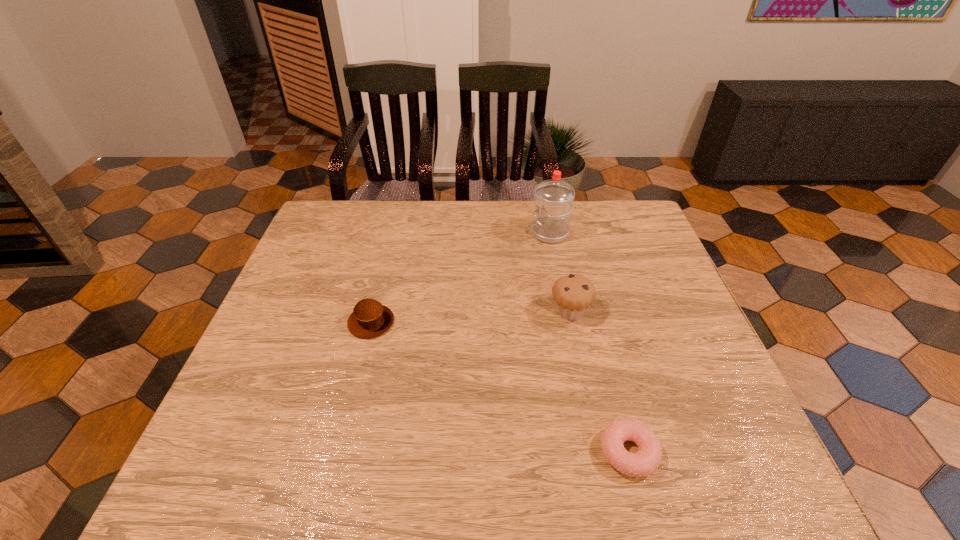
At what (x,y) coordinates should I click in order to perform the action: click on the tallest object. Please return your answer as a coordinate pair (x, y). Image resolution: width=960 pixels, height=540 pixels. Looking at the image, I should click on (554, 197).

Where is `the farthest object`? Image resolution: width=960 pixels, height=540 pixels. the farthest object is located at coordinates (554, 197).

You are a GUI agent. You are given a task and a screenshot of the screen. Output one action in this format:
    pyautogui.click(x=<x>, y=<y>)
    Task: Click on the taller muffin
    Image resolution: width=960 pixels, height=540 pixels.
    Given the screenshot: What is the action you would take?
    pyautogui.click(x=573, y=294)

Image resolution: width=960 pixels, height=540 pixels. Identify the location of the third shortest object. (573, 294).

This screenshot has width=960, height=540. I want to click on the shorter muffin, so click(369, 319).

Image resolution: width=960 pixels, height=540 pixels. I want to click on the left muffin, so click(x=369, y=319).

This screenshot has height=540, width=960. I want to click on the nearest object, so click(x=646, y=461).

Where is `the shortest object`? the shortest object is located at coordinates (646, 461).

Locate an element on the screen. The height and width of the screenshot is (540, 960). free space located 0.220m on the handle side of the tallest object is located at coordinates (460, 233).

This screenshot has height=540, width=960. What are the coordinates of `vacant area situated on the handle side of the tallest object` in the screenshot? It's located at (421, 233).